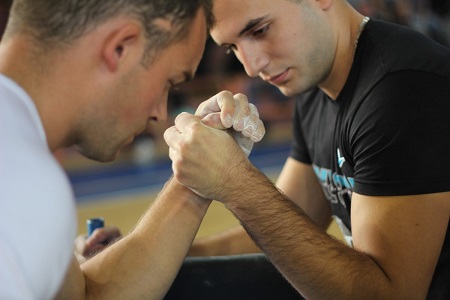
Where is `handle`? handle is located at coordinates (94, 222).